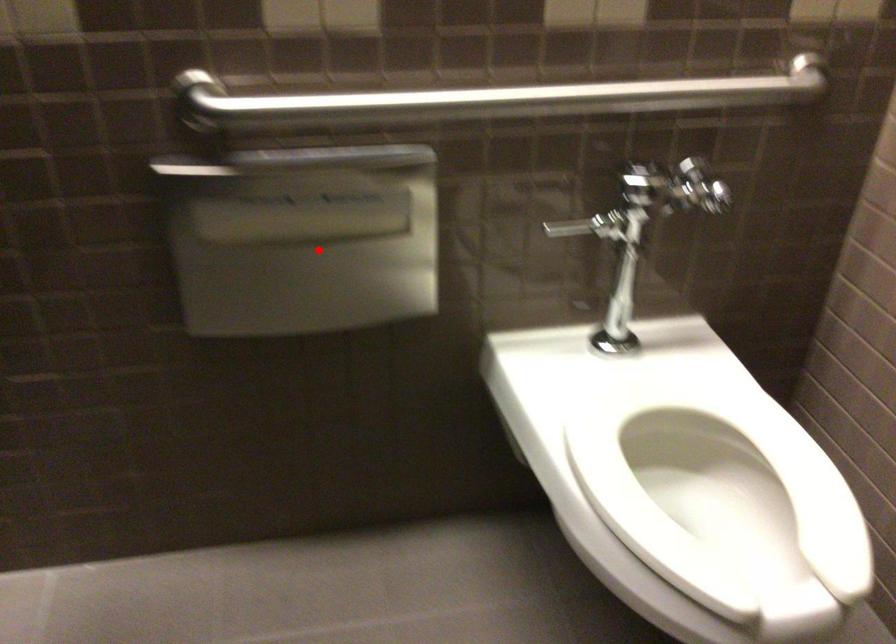
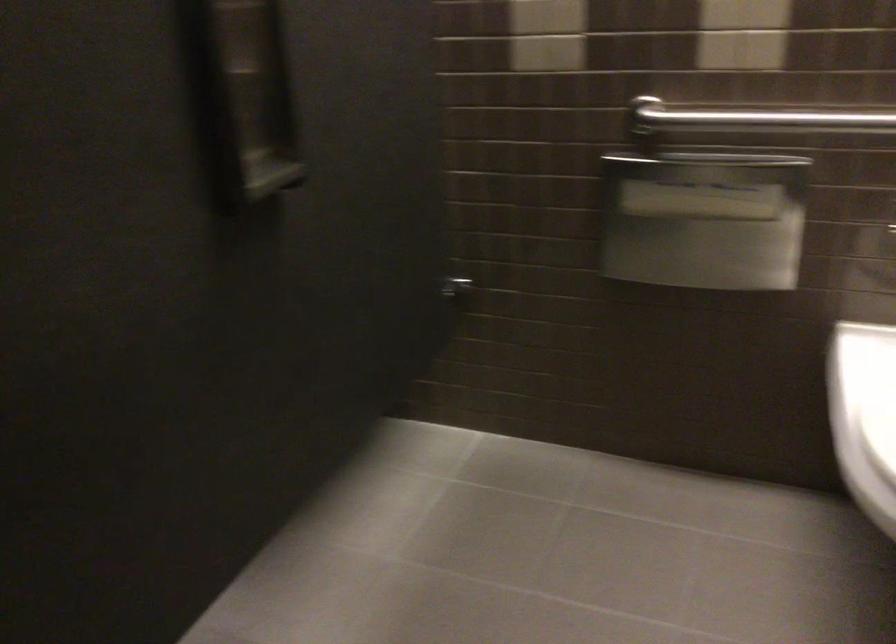
Locate, in the second image, the point that corresponds to the highlighted location in the first image.

(703, 220)